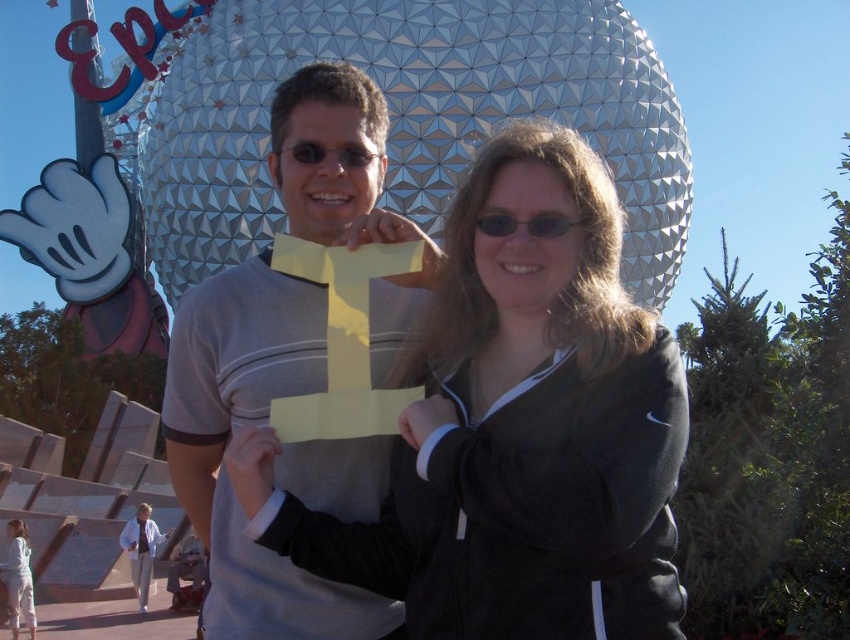
What are the coordinates of `gray matte t-shirt at center` in the screenshot? It's located at (228, 438).

Can you confirm if gray matte t-shirt at center is positioned above black plastic sunglasses at center?

No.

Measure the distance between point (321,237) and camera.

A distance of 55.44 meters exists between point (321,237) and camera.

Identify the location of gray matte t-shirt at center. This screenshot has width=850, height=640. (228, 438).

Looking at this image, can you confirm if black plastic sunglasses at center is smaller than matte black sunglasses at center?

Yes, black plastic sunglasses at center is smaller than matte black sunglasses at center.

Can you confirm if black plastic sunglasses at center is positioned above matte black sunglasses at center?

Incorrect, black plastic sunglasses at center is not positioned above matte black sunglasses at center.

The width and height of the screenshot is (850, 640). I want to click on black plastic sunglasses at center, so click(x=525, y=225).

The image size is (850, 640). Find the location of `black matte jacket at center`. black matte jacket at center is located at coordinates (516, 429).

Is black matte jacket at center wider than black plastic sunglasses at center?

Correct, the width of black matte jacket at center exceeds that of black plastic sunglasses at center.

Does point (507, 547) lie in front of point (567, 221)?

Yes, it is in front of point (567, 221).

Locate an element on the screen. The image size is (850, 640). black matte jacket at center is located at coordinates (516, 429).